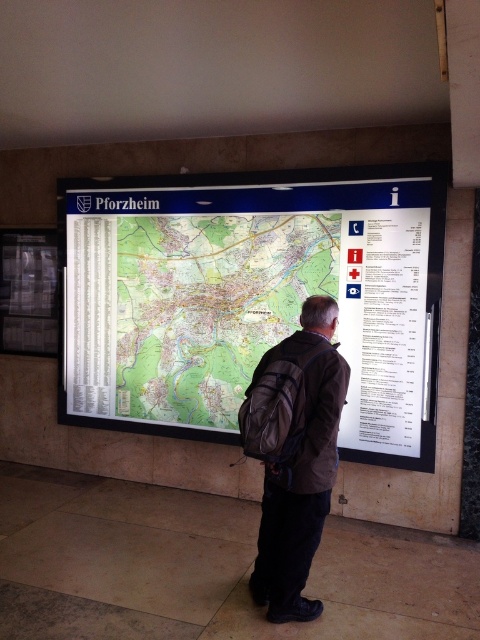
Question: Which of the following is the farthest from the observer?

Choices:
 (A) (313, 435)
 (B) (433, 324)

Answer: (B)

Question: Which point is farther to the camera?

Choices:
 (A) brown fabric backpack at center
 (B) green paper map at center

Answer: (B)

Question: Does green paper map at center appear on the left side of brown fabric backpack at center?

Choices:
 (A) yes
 (B) no

Answer: (A)

Question: Can you confirm if green paper map at center is thinner than brown fabric backpack at center?

Choices:
 (A) yes
 (B) no

Answer: (B)

Question: Is green paper map at center thinner than brown fabric backpack at center?

Choices:
 (A) no
 (B) yes

Answer: (A)